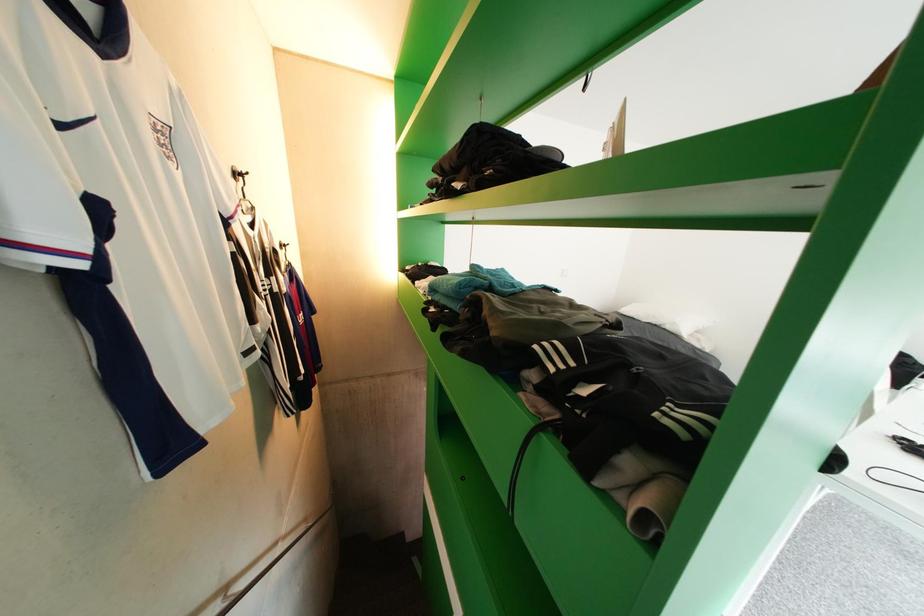
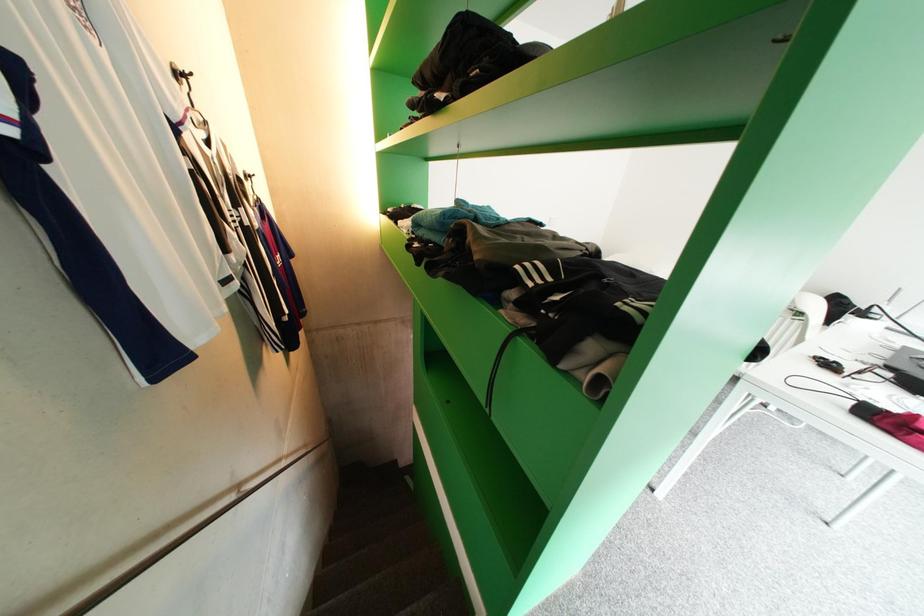
Question: What movement of the cameraman would produce the second image?

Choices:
 (A) Left
 (B) Right
 (C) Forward
 (D) Backward

Answer: (D)